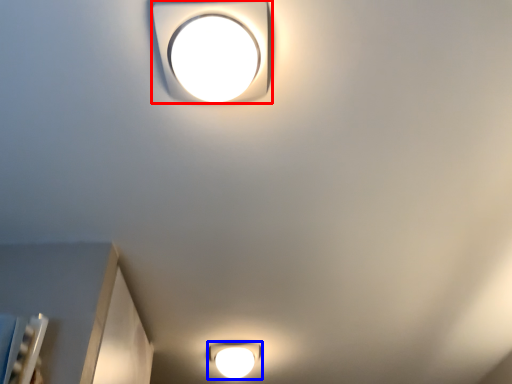
Question: Among these objects, which one is farthest to the camera, lamp (highlighted by a red box) or lamp (highlighted by a blue box)?

Choices:
 (A) lamp
 (B) lamp

Answer: (B)